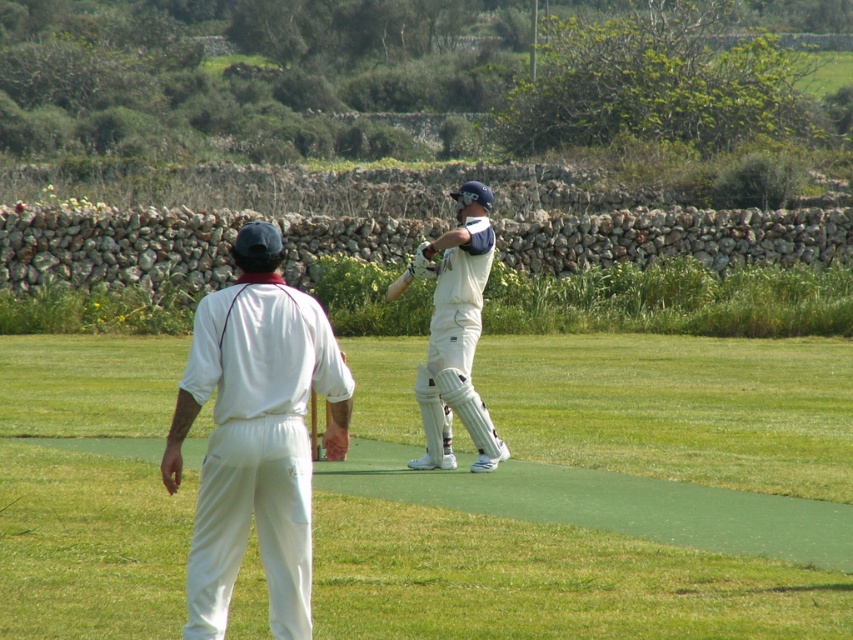
You are a spectator at the cricket match and want to take a photo of both the white fabric cricket uniform at center and the white matte cricket bat at center. Which object should you focus on first to ensure it appears in the foreground of your photo?

The white fabric cricket uniform at center is in front of the white matte cricket bat at center, so you should focus on the white fabric cricket uniform at center first to ensure it appears in the foreground.

Looking at this image, you are a photographer trying to capture a photo of both the white fabric cricket uniform at center and the white matte cricket bat at center. You want to arrange them in a way that the uniform is positioned to the left of the bat. Is the current arrangement of the objects in the image suitable for your photo?

Yes, the current arrangement is suitable because the white fabric cricket uniform at center is already positioned to the left of the white matte cricket bat at center, as described in the scene.